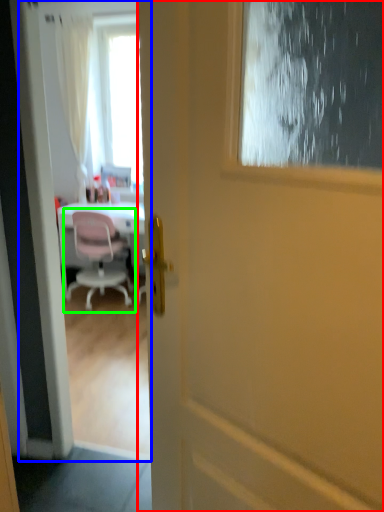
Question: Based on their relative distances, which object is nearer to door (highlighted by a red box)? Choose from screen door (highlighted by a blue box) and chair (highlighted by a green box).

Choices:
 (A) screen door
 (B) chair

Answer: (A)